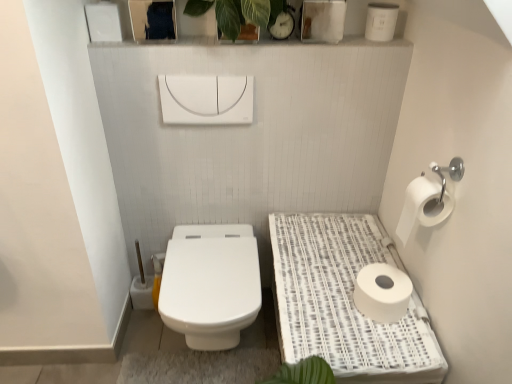
Image resolution: width=512 pixels, height=384 pixels. In order to click on vacant space to the left of white matte toilet paper at lower right, acting as the first toilet paper starting from the bottom in this screenshot , I will do `click(324, 301)`.